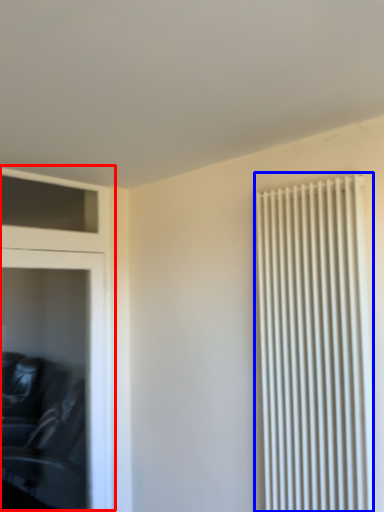
Question: Which object is closer to the camera taking this photo, dresser (highlighted by a red box) or radiator (highlighted by a blue box)?

Choices:
 (A) dresser
 (B) radiator

Answer: (B)